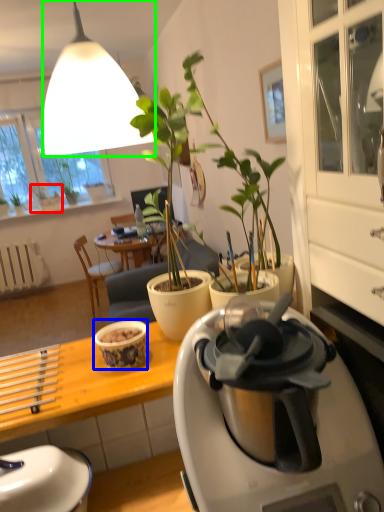
Question: Which is nearer to the houseplant (highlighted by a red box)? coffee cup (highlighted by a blue box) or lamp (highlighted by a green box).

Choices:
 (A) coffee cup
 (B) lamp

Answer: (A)